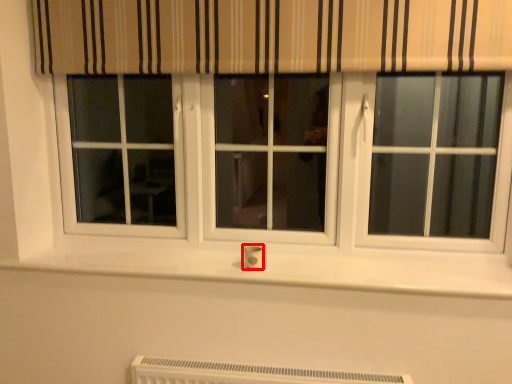
Question: From the image, what is the correct spatial relationship of electric outlet (annotated by the red box) in relation to heater?

Choices:
 (A) right
 (B) left

Answer: (B)